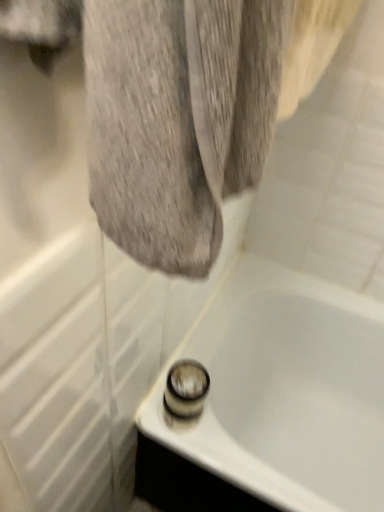
Where is `white glossy bathtub at lower center`? The height and width of the screenshot is (512, 384). white glossy bathtub at lower center is located at coordinates (273, 402).

The width and height of the screenshot is (384, 512). What do you see at coordinates (273, 402) in the screenshot?
I see `white glossy bathtub at lower center` at bounding box center [273, 402].

Describe the element at coordinates (186, 390) in the screenshot. I see `shiny chrome shower at bottom center` at that location.

Where is `shiny chrome shower at bottom center`? shiny chrome shower at bottom center is located at coordinates (186, 390).

Find the location of `white glossy bathtub at lower center`. white glossy bathtub at lower center is located at coordinates (273, 402).

Considering the positions of objects shiny chrome shower at bottom center and white glossy bathtub at lower center in the image provided, who is more to the right, shiny chrome shower at bottom center or white glossy bathtub at lower center?

Positioned to the right is white glossy bathtub at lower center.

Relative to white glossy bathtub at lower center, is shiny chrome shower at bottom center in front or behind?

shiny chrome shower at bottom center is positioned farther from the viewer than white glossy bathtub at lower center.

Does point (191, 370) appear closer or farther from the camera than point (218, 330)?

Clearly, point (191, 370) is closer to the camera than point (218, 330).

From the image's perspective, is shiny chrome shower at bottom center above white glossy bathtub at lower center?

Yes, from the image's perspective, shiny chrome shower at bottom center is above white glossy bathtub at lower center.

From a real-world perspective, who is located higher, shiny chrome shower at bottom center or white glossy bathtub at lower center?

shiny chrome shower at bottom center.

Looking at this image, is shiny chrome shower at bottom center wider or thinner than white glossy bathtub at lower center?

In the image, shiny chrome shower at bottom center appears to be more narrow than white glossy bathtub at lower center.

Can you confirm if shiny chrome shower at bottom center is taller than white glossy bathtub at lower center?

Incorrect, the height of shiny chrome shower at bottom center is not larger of that of white glossy bathtub at lower center.

Is shiny chrome shower at bottom center bigger or smaller than white glossy bathtub at lower center?

Considering their sizes, shiny chrome shower at bottom center takes up less space than white glossy bathtub at lower center.

Would you say shiny chrome shower at bottom center contains white glossy bathtub at lower center?

No, white glossy bathtub at lower center is not inside shiny chrome shower at bottom center.

Based on the photo, is shiny chrome shower at bottom center with white glossy bathtub at lower center?

shiny chrome shower at bottom center and white glossy bathtub at lower center are clearly separated.

Is shiny chrome shower at bottom center positioned with its back to white glossy bathtub at lower center?

No, white glossy bathtub at lower center is not at the back of shiny chrome shower at bottom center.

How different are the orientations of shiny chrome shower at bottom center and white glossy bathtub at lower center in degrees?

The angle between the facing direction of shiny chrome shower at bottom center and the facing direction of white glossy bathtub at lower center is 90 degrees.

Identify the location of shower behind the white glossy bathtub at lower center. The width and height of the screenshot is (384, 512). (186, 390).

Between white glossy bathtub at lower center and shiny chrome shower at bottom center, which one appears on the left side from the viewer's perspective?

shiny chrome shower at bottom center.

Which object is further away from the camera taking this photo, white glossy bathtub at lower center or shiny chrome shower at bottom center?

shiny chrome shower at bottom center is further from the camera.

Does point (272, 411) lie in front of point (192, 395)?

No, (272, 411) is behind (192, 395).

From the image's perspective, between white glossy bathtub at lower center and shiny chrome shower at bottom center, who is located below?

white glossy bathtub at lower center is shown below in the image.

From a real-world perspective, which is physically above, white glossy bathtub at lower center or shiny chrome shower at bottom center?

shiny chrome shower at bottom center.

Which object is wider, white glossy bathtub at lower center or shiny chrome shower at bottom center?

With larger width is white glossy bathtub at lower center.

Is white glossy bathtub at lower center taller or shorter than shiny chrome shower at bottom center?

Clearly, white glossy bathtub at lower center is taller compared to shiny chrome shower at bottom center.

Considering the relative sizes of white glossy bathtub at lower center and shiny chrome shower at bottom center in the image provided, is white glossy bathtub at lower center bigger than shiny chrome shower at bottom center?

Yes.

Is white glossy bathtub at lower center inside the boundaries of shiny chrome shower at bottom center, or outside?

white glossy bathtub at lower center is not enclosed by shiny chrome shower at bottom center.

Is white glossy bathtub at lower center not near shiny chrome shower at bottom center?

No, white glossy bathtub at lower center is in close proximity to shiny chrome shower at bottom center.

Is white glossy bathtub at lower center facing away from shiny chrome shower at bottom center?

white glossy bathtub at lower center is not turned away from shiny chrome shower at bottom center.

Measure the distance from white glossy bathtub at lower center to shiny chrome shower at bottom center.

white glossy bathtub at lower center and shiny chrome shower at bottom center are 15.25 inches apart from each other.

You are a GUI agent. You are given a task and a screenshot of the screen. Output one action in this format:
    pyautogui.click(x=<x>, y=<y>)
    Task: Click on the shower located above the white glossy bathtub at lower center (from a real-world perspective)
    This screenshot has height=512, width=384.
    Given the screenshot: What is the action you would take?
    pyautogui.click(x=186, y=390)

Find the location of a particular element. This screenshot has width=384, height=512. bathtub below the shiny chrome shower at bottom center (from the image's perspective) is located at coordinates (273, 402).

This screenshot has width=384, height=512. I want to click on bathtub that appears on the right of shiny chrome shower at bottom center, so (x=273, y=402).